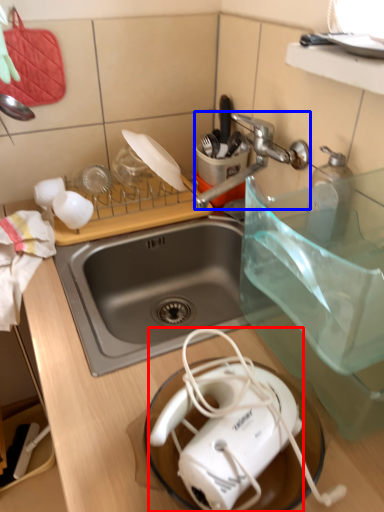
Question: Which point is closer to the camera, toaster (highlighted by a red box) or faucet (highlighted by a blue box)?

Choices:
 (A) toaster
 (B) faucet

Answer: (A)